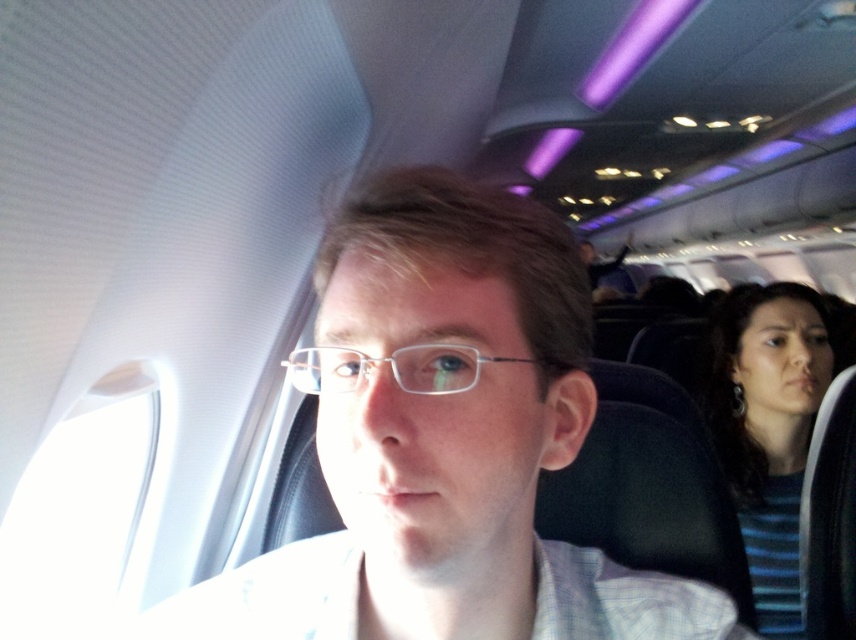
Question: Is matte white shirt at center above blue striped shirt at right?

Choices:
 (A) yes
 (B) no

Answer: (A)

Question: Among these objects, which one is nearest to the camera?

Choices:
 (A) clear plastic glasses at center
 (B) matte white shirt at center
 (C) blue striped shirt at right

Answer: (B)

Question: Estimate the real-world distances between objects in this image. Which object is closer to the blue striped shirt at right?

Choices:
 (A) clear plastic glasses at center
 (B) matte white shirt at center

Answer: (B)

Question: Can you confirm if blue striped shirt at right is wider than clear plastic glasses at center?

Choices:
 (A) no
 (B) yes

Answer: (B)

Question: Can you confirm if matte white shirt at center is bigger than clear plastic glasses at center?

Choices:
 (A) no
 (B) yes

Answer: (B)

Question: Which of the following is the closest to the observer?

Choices:
 (A) clear plastic glasses at center
 (B) blue striped shirt at right
 (C) matte white shirt at center

Answer: (C)